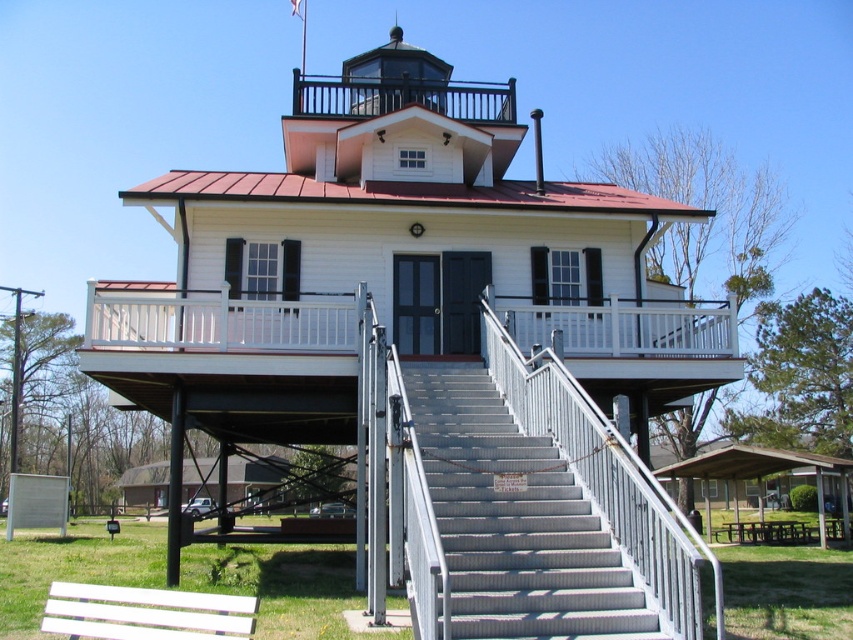
Question: Can you confirm if metallic gray stairs at center is positioned to the right of white painted wood bench at lower left?

Choices:
 (A) no
 (B) yes

Answer: (B)

Question: Which object is closer to the camera taking this photo?

Choices:
 (A) metallic gray stairs at center
 (B) white painted wood bench at lower left

Answer: (B)

Question: Which object appears closest to the camera in this image?

Choices:
 (A) white painted wood bench at lower left
 (B) metallic gray stairs at center

Answer: (A)

Question: Is metallic gray stairs at center below white painted wood bench at lower left?

Choices:
 (A) no
 (B) yes

Answer: (B)

Question: Observing the image, what is the correct spatial positioning of metallic gray stairs at center in reference to white painted wood bench at lower left?

Choices:
 (A) below
 (B) above

Answer: (A)